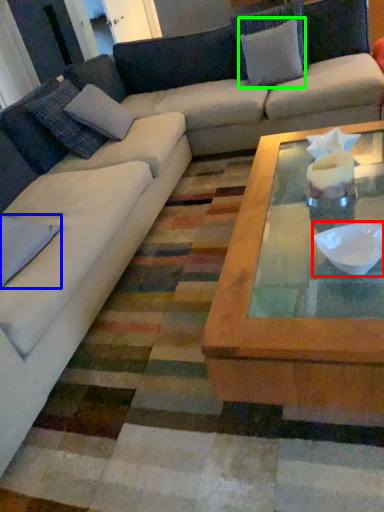
Question: Which object is positioned closest to bowl (highlighted by a red box)? Select from pillow (highlighted by a blue box) and pillow (highlighted by a green box).

Choices:
 (A) pillow
 (B) pillow

Answer: (A)